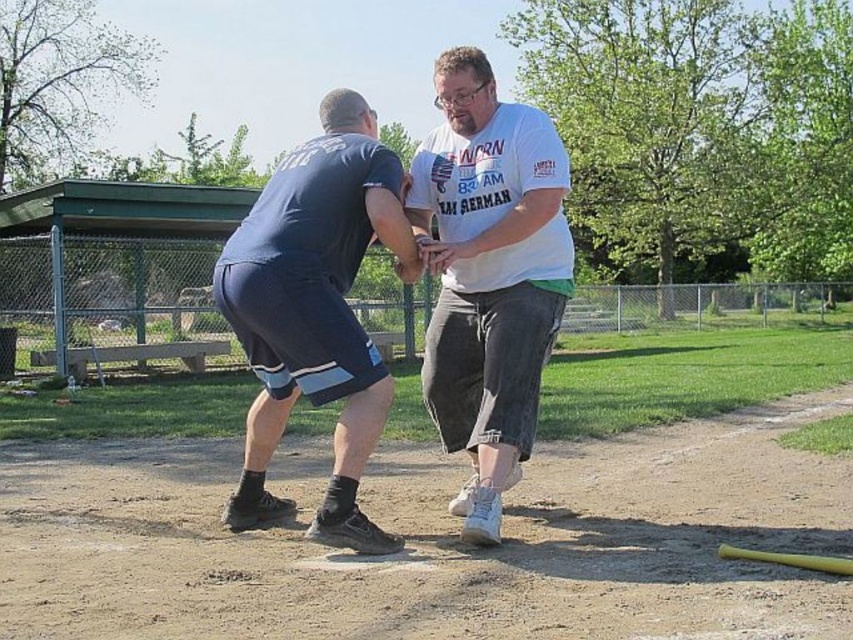
In the scene shown: Does white cotton shirt at center appear on the right side of dark blue shorts at left?

Indeed, white cotton shirt at center is positioned on the right side of dark blue shorts at left.

Consider the image. Measure the distance between white cotton shirt at center and camera.

They are 4.86 meters apart.

Measure the distance between white cotton shirt at center and camera.

4.86 meters

You are a GUI agent. You are given a task and a screenshot of the screen. Output one action in this format:
    pyautogui.click(x=<x>, y=<y>)
    Task: Click on the white cotton shirt at center
    The height and width of the screenshot is (640, 853).
    Given the screenshot: What is the action you would take?
    pyautogui.click(x=488, y=275)

Is point (558, 284) positioned in front of point (781, 561)?

No, (558, 284) is further to viewer.

Can you confirm if white cotton shirt at center is positioned to the right of yellow matte baseball bat at lower right?

Incorrect, white cotton shirt at center is not on the right side of yellow matte baseball bat at lower right.

Image resolution: width=853 pixels, height=640 pixels. I want to click on white cotton shirt at center, so click(x=488, y=275).

This screenshot has height=640, width=853. What are the coordinates of `white cotton shirt at center` in the screenshot? It's located at (488, 275).

Who is positioned more to the left, dark blue shorts at left or yellow matte baseball bat at lower right?

dark blue shorts at left is more to the left.

Between dark blue shorts at left and yellow matte baseball bat at lower right, which one is positioned lower?

Positioned lower is yellow matte baseball bat at lower right.

Image resolution: width=853 pixels, height=640 pixels. Identify the location of dark blue shorts at left. (315, 310).

Identify the location of dark blue shorts at left. (315, 310).